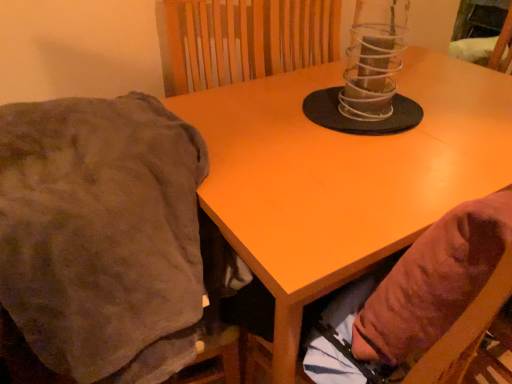
Question: Does clear plastic candle holder at center have a lesser width compared to matte orange table at center?

Choices:
 (A) no
 (B) yes

Answer: (B)

Question: Does clear plastic candle holder at center have a greater height compared to matte orange table at center?

Choices:
 (A) yes
 (B) no

Answer: (B)

Question: From the image's perspective, is clear plastic candle holder at center located above matte orange table at center?

Choices:
 (A) yes
 (B) no

Answer: (A)

Question: Is clear plastic candle holder at center to the left of matte orange table at center from the viewer's perspective?

Choices:
 (A) yes
 (B) no

Answer: (A)

Question: From the image's perspective, is clear plastic candle holder at center located beneath matte orange table at center?

Choices:
 (A) no
 (B) yes

Answer: (A)

Question: In terms of size, does matte orange table at center appear bigger or smaller than brown fuzzy blanket at left?

Choices:
 (A) small
 (B) big

Answer: (B)

Question: In the image, is matte orange table at center on the left side or the right side of brown fuzzy blanket at left?

Choices:
 (A) right
 (B) left

Answer: (A)

Question: From a real-world perspective, is matte orange table at center positioned above or below brown fuzzy blanket at left?

Choices:
 (A) above
 (B) below

Answer: (B)

Question: Relative to brown fuzzy blanket at left, is matte orange table at center in front or behind?

Choices:
 (A) front
 (B) behind

Answer: (B)

Question: In the image, is brown fabric bean bag chair at lower right positioned in front of or behind brown fuzzy blanket at left?

Choices:
 (A) front
 (B) behind

Answer: (B)

Question: From their relative heights in the image, would you say brown fabric bean bag chair at lower right is taller or shorter than brown fuzzy blanket at left?

Choices:
 (A) tall
 (B) short

Answer: (B)

Question: From the image's perspective, is brown fabric bean bag chair at lower right located above or below brown fuzzy blanket at left?

Choices:
 (A) above
 (B) below

Answer: (A)

Question: Considering the positions of brown fabric bean bag chair at lower right and brown fuzzy blanket at left in the image, is brown fabric bean bag chair at lower right wider or thinner than brown fuzzy blanket at left?

Choices:
 (A) wide
 (B) thin

Answer: (B)

Question: Visually, is brown fabric bean bag chair at lower right positioned to the left or to the right of clear plastic candle holder at center?

Choices:
 (A) left
 (B) right

Answer: (B)

Question: Looking at the image, does brown fabric bean bag chair at lower right seem bigger or smaller compared to clear plastic candle holder at center?

Choices:
 (A) small
 (B) big

Answer: (B)